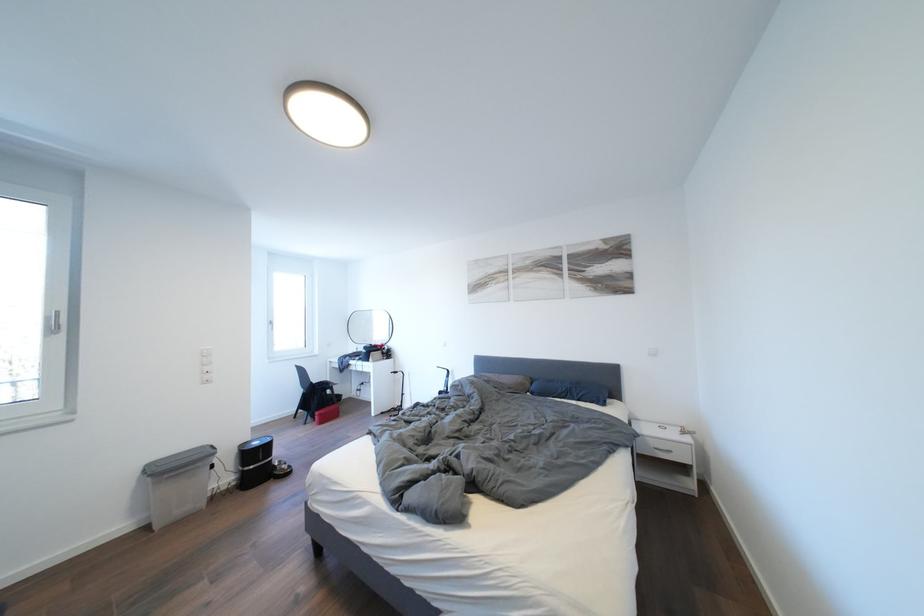
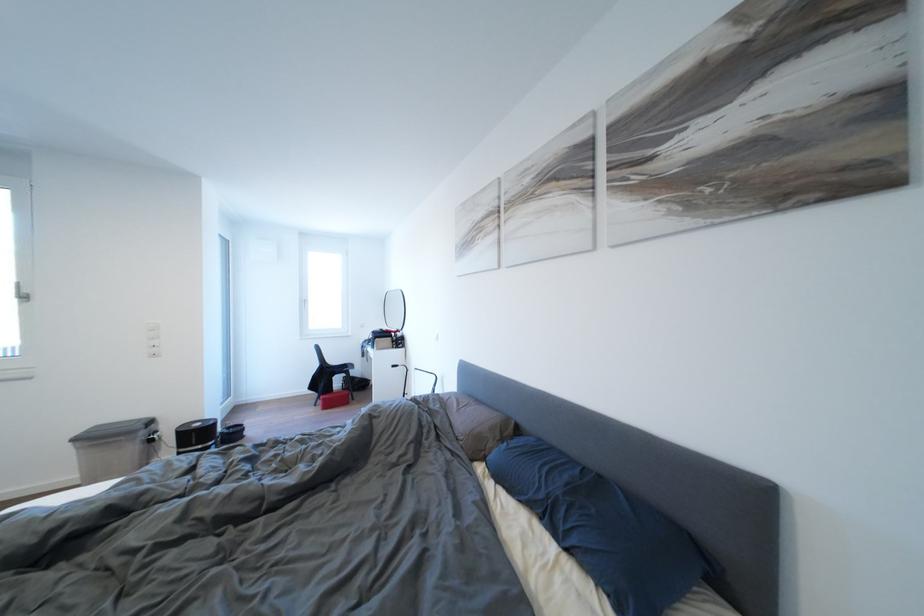
Based on the photo, the images are taken continuously from a first-person perspective. In which direction are you moving?

The cameraman moved toward right, forward.